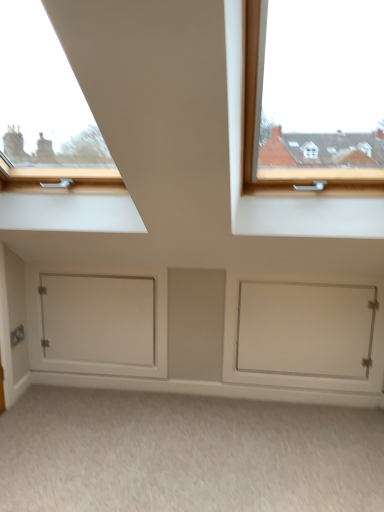
Question: From their relative heights in the image, would you say white matte door at lower right, which is the second door in left-to-right order, is taller or shorter than beige carpet at lower center?

Choices:
 (A) short
 (B) tall

Answer: (B)

Question: Is white matte door at lower right, the first door when ordered from right to left, in front of or behind beige carpet at lower center in the image?

Choices:
 (A) behind
 (B) front

Answer: (A)

Question: Which of these objects is positioned farthest from the beige carpet at lower center?

Choices:
 (A) white matte door at lower left, which is the 2th door in right-to-left order
 (B) white matte door at lower right, which is the second door in left-to-right order

Answer: (A)

Question: Estimate the real-world distances between objects in this image. Which object is closer to the beige carpet at lower center?

Choices:
 (A) white matte door at lower left, the first door when ordered from left to right
 (B) white matte door at lower right, the first door when ordered from right to left

Answer: (B)